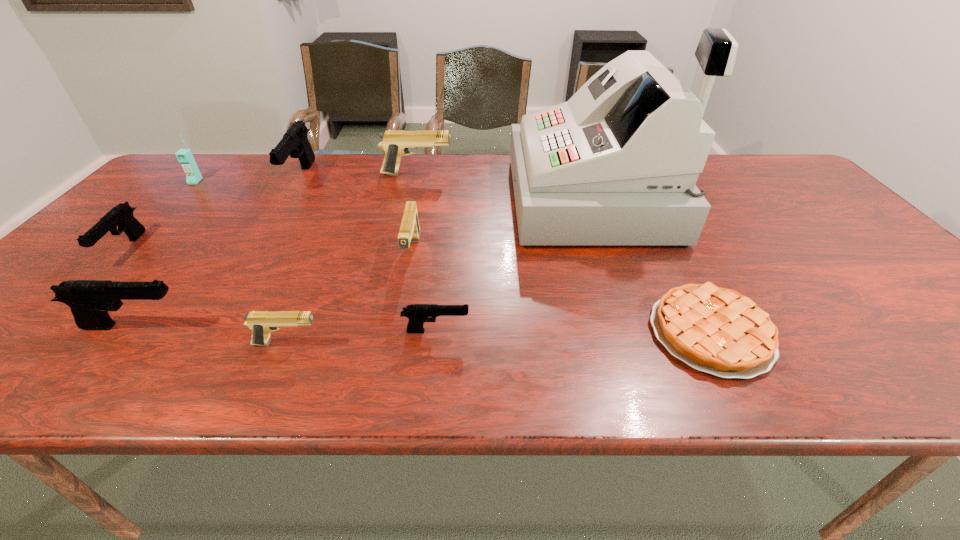
You are a GUI agent. You are given a task and a screenshot of the screen. Output one action in this format:
    pyautogui.click(x=<x>, y=<y>)
    Task: Click on the tallest object
    
    Given the screenshot: What is the action you would take?
    pyautogui.click(x=617, y=164)

The image size is (960, 540). Identify the location of gray cash register. (617, 164).

Where is `the biggest black pistol`? the biggest black pistol is located at coordinates (295, 143).

This screenshot has width=960, height=540. What are the coordinates of `the seventh object from right to left` in the screenshot? It's located at (295, 143).

The width and height of the screenshot is (960, 540). Identify the location of cellular telephone. (193, 176).

Where is `the farthest tan pistol`? The image size is (960, 540). the farthest tan pistol is located at coordinates 395,143.

Locate an element on the screen. the second black pistol from left to right is located at coordinates (x=90, y=300).

At what (x,y) coordinates should I click in order to perform the action: click on the third object from left to right. Please return your answer as a coordinate pair (x, y). The height and width of the screenshot is (540, 960). Looking at the image, I should click on (90, 300).

Where is `the second farthest tan pistol`? This screenshot has height=540, width=960. the second farthest tan pistol is located at coordinates pos(409,231).

This screenshot has height=540, width=960. Find the location of `the second farthest black pistol`. the second farthest black pistol is located at coordinates (121, 215).